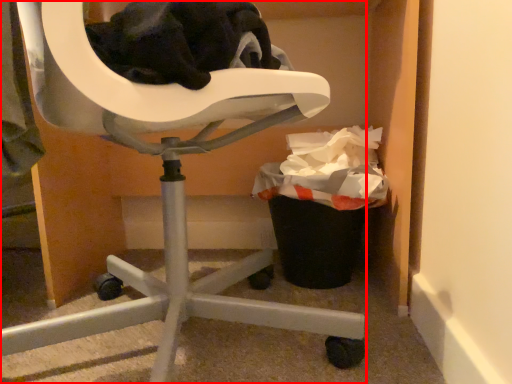
Question: From the image's perspective, where is chair (annotated by the red box) located relative to recycling bin?

Choices:
 (A) above
 (B) below

Answer: (A)